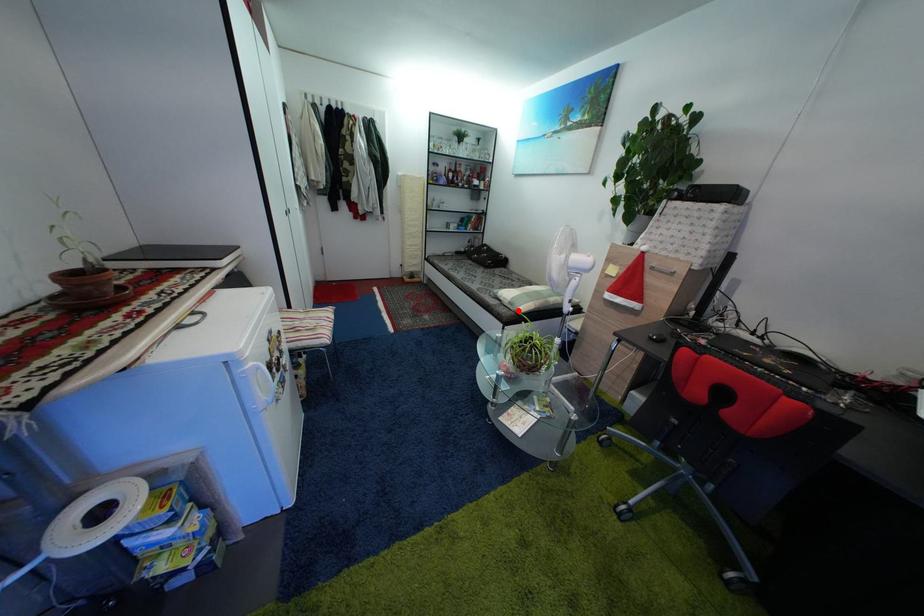
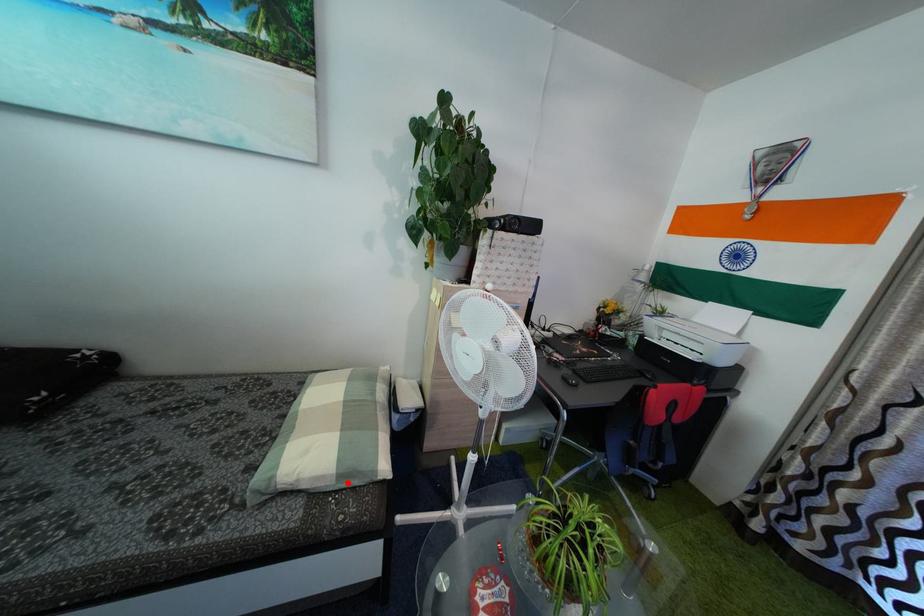
I am providing you with two images of the same scene from different viewpoints. A red point is marked on the first image and another point is marked on the second image. Is the red point in image1 aligned with the point shown in image2?

Yes